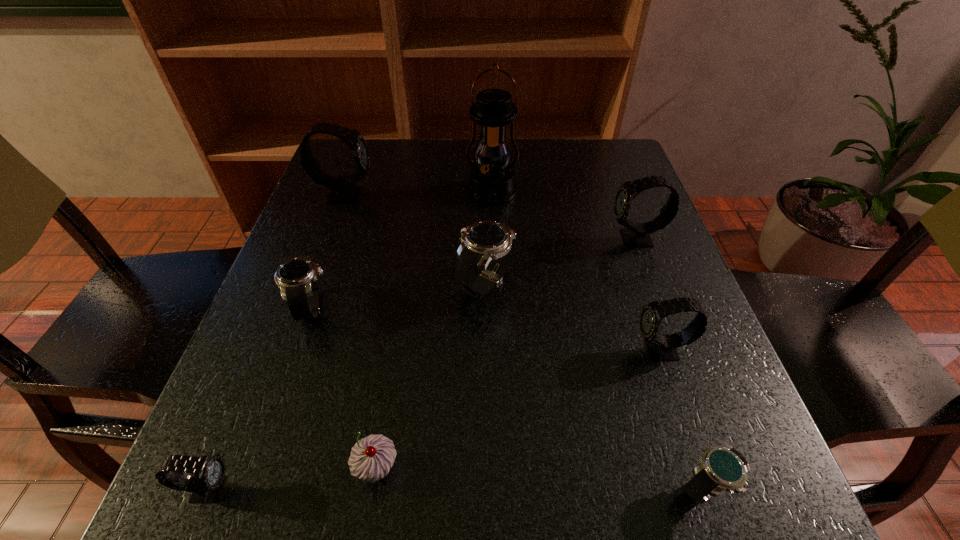
Find the location of a particular element. The width and height of the screenshot is (960, 540). free spot that satisfies the following two spatial constraints: 1. on the face of the sixth nearest watch; 2. on the front side of the fourth watch from left to right is located at coordinates (652, 283).

Identify the location of free space in the image that satisfies the following two spatial constraints: 1. on the face of the biggest silver watch; 2. on the left side of the tallest watch. This screenshot has width=960, height=540. (314, 283).